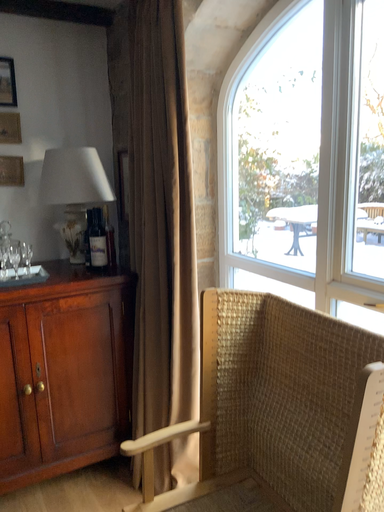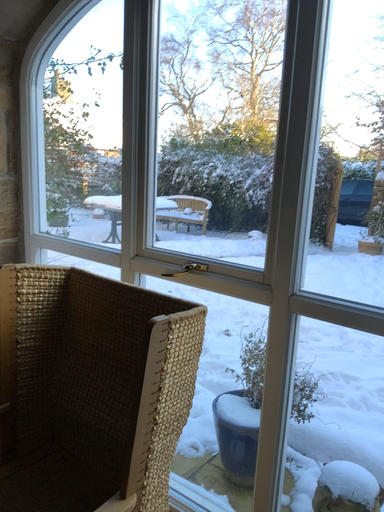
Question: Which way did the camera rotate in the video?

Choices:
 (A) rotated right
 (B) rotated left

Answer: (A)